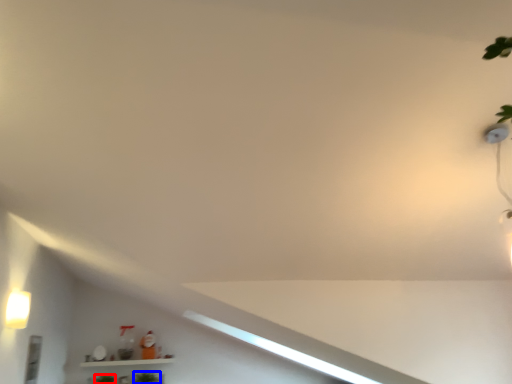
Question: Which object appears closest to the camera in this image, plant (highlighted by a red box) or plant (highlighted by a blue box)?

Choices:
 (A) plant
 (B) plant

Answer: (A)